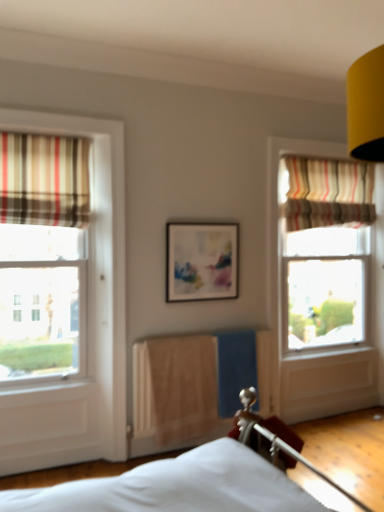
Question: Is striped fabric curtain at upper right, which ranks as the 2th curtain in front-to-back order, bigger or smaller than matte plastic picture frame at center?

Choices:
 (A) small
 (B) big

Answer: (B)

Question: In terms of width, does striped fabric curtain at upper right, acting as the first curtain starting from the right, look wider or thinner when compared to matte plastic picture frame at center?

Choices:
 (A) wide
 (B) thin

Answer: (A)

Question: Which object is the closest to the matte plastic picture frame at center?

Choices:
 (A) striped fabric curtain at left, which is the 2th curtain in right-to-left order
 (B) striped fabric curtain at upper right, acting as the first curtain starting from the right
 (C) beige fabric radiator at center

Answer: (C)

Question: Estimate the real-world distances between objects in this image. Which object is farther from the matte plastic picture frame at center?

Choices:
 (A) beige fabric radiator at center
 (B) striped fabric curtain at left, the 2th curtain positioned from the back
 (C) striped fabric curtain at upper right, which appears as the 1th curtain when viewed from the back

Answer: (C)